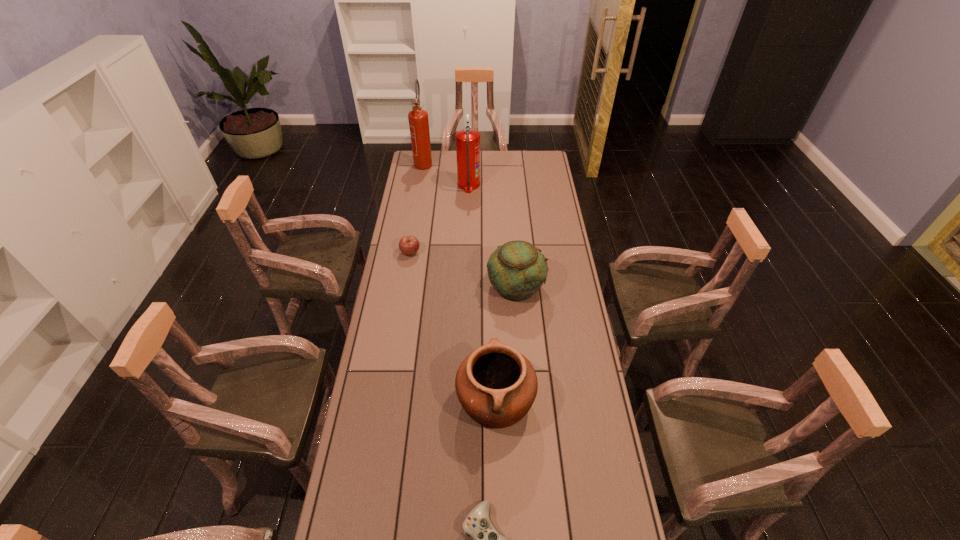
At what (x,y) coordinates should I click in order to perform the action: click on free location located 0.370m on the back of the second nearest object. Please return your answer as a coordinate pair (x, y). Looking at the image, I should click on (492, 292).

Locate an element on the screen. vacant space located 0.370m on the front of the farther pottery is located at coordinates (524, 390).

Locate an element on the screen. The width and height of the screenshot is (960, 540). free point located on the side of the fourth nearest object with the unique marking is located at coordinates (405, 286).

At what (x,y) coordinates should I click in order to perform the action: click on object present at the far edge. Please return your answer as a coordinate pair (x, y). This screenshot has height=540, width=960. Looking at the image, I should click on (418, 118).

Where is `fire extinguisher that is at the left edge`? Image resolution: width=960 pixels, height=540 pixels. fire extinguisher that is at the left edge is located at coordinates coord(418,118).

In order to click on apple that is positioned at the left edge in this screenshot , I will do `click(409, 245)`.

The width and height of the screenshot is (960, 540). Find the location of `object positioned at the right edge`. object positioned at the right edge is located at coordinates (517, 269).

I want to click on object situated at the far left corner, so click(x=418, y=118).

Identify the location of free space at the left edge. (393, 257).

Find the location of a particular element. Image resolution: width=960 pixels, height=540 pixels. vacant space at the right edge of the desktop is located at coordinates (587, 529).